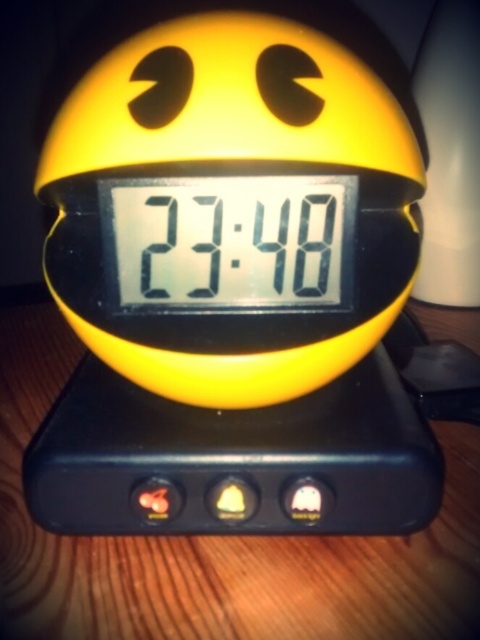
You are standing in front of the Pac Man shaped digital alarm clock. There is a point at coordinates point [399,65]. Can you reach that point with your hand?

The point at [399,65] is 1.29 meters away from you, so you cannot reach it with your hand.